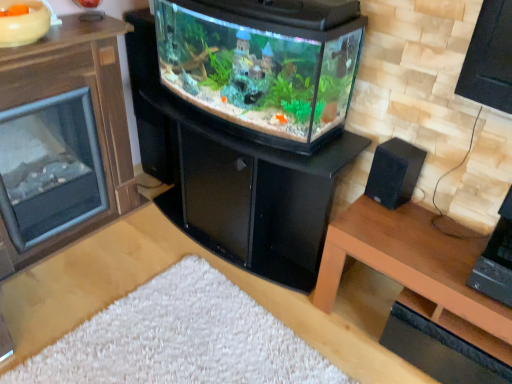
I want to click on empty space that is in between black glossy fireplace at center and brown wood fireplace at left, so click(140, 271).